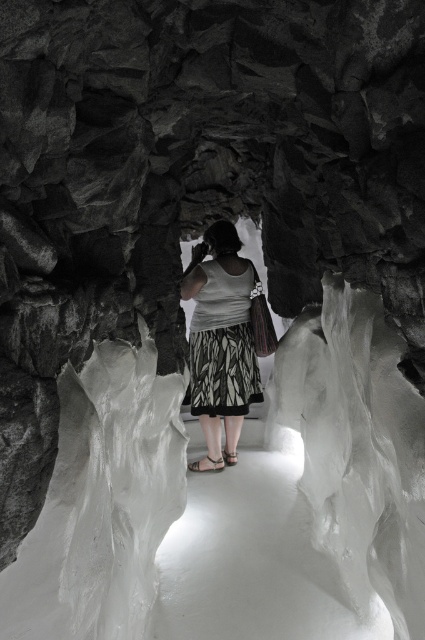
Who is more distant from viewer, (200, 468) or (237, 460)?

Positioned behind is point (237, 460).

Does white fabric sandal at center have a greater height compared to brown leather sandal at center?

Indeed, white fabric sandal at center has a greater height compared to brown leather sandal at center.

Measure the distance between point (215, 470) and camera.

Point (215, 470) and camera are 12.89 feet apart.

You are a GUI agent. You are given a task and a screenshot of the screen. Output one action in this format:
    pyautogui.click(x=<x>, y=<y>)
    Task: Click on the white fabric sandal at center
    This screenshot has width=425, height=640.
    Given the screenshot: What is the action you would take?
    [206, 465]

Does printed fabric dress at center have a lesser height compared to white fabric sandal at center?

No, printed fabric dress at center is not shorter than white fabric sandal at center.

What do you see at coordinates (223, 346) in the screenshot? Image resolution: width=425 pixels, height=640 pixels. I see `printed fabric dress at center` at bounding box center [223, 346].

Locate an element on the screen. This screenshot has height=640, width=425. printed fabric dress at center is located at coordinates (223, 346).

Is printed fabric dress at center wider than brown leather sandal at center?

Correct, the width of printed fabric dress at center exceeds that of brown leather sandal at center.

This screenshot has height=640, width=425. Describe the element at coordinates (223, 346) in the screenshot. I see `printed fabric dress at center` at that location.

Is point (207, 291) more distant than point (232, 458)?

No.

Locate an element on the screen. This screenshot has width=425, height=640. printed fabric dress at center is located at coordinates (223, 346).